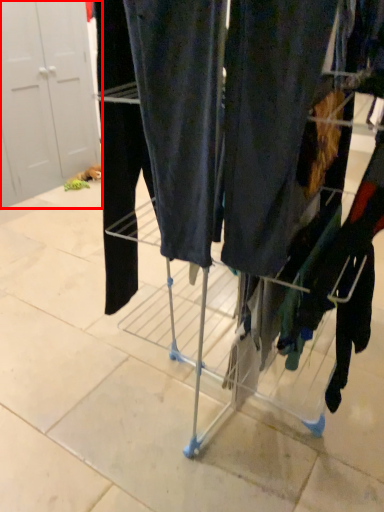
Question: From the image's perspective, where is door (annotated by the red box) located relative to trolley?

Choices:
 (A) below
 (B) above

Answer: (B)